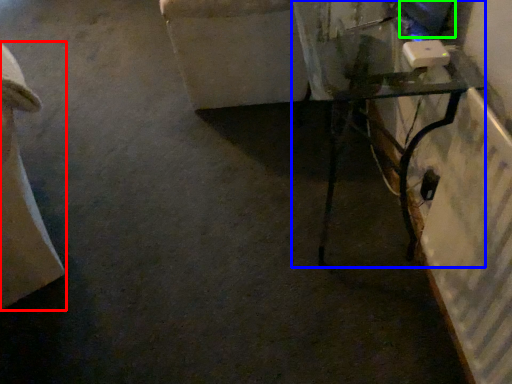
Question: Which object is the farthest from furniture (highlighted by a red box)? Choose among these: table (highlighted by a blue box) or computer screen (highlighted by a green box).

Choices:
 (A) table
 (B) computer screen

Answer: (B)